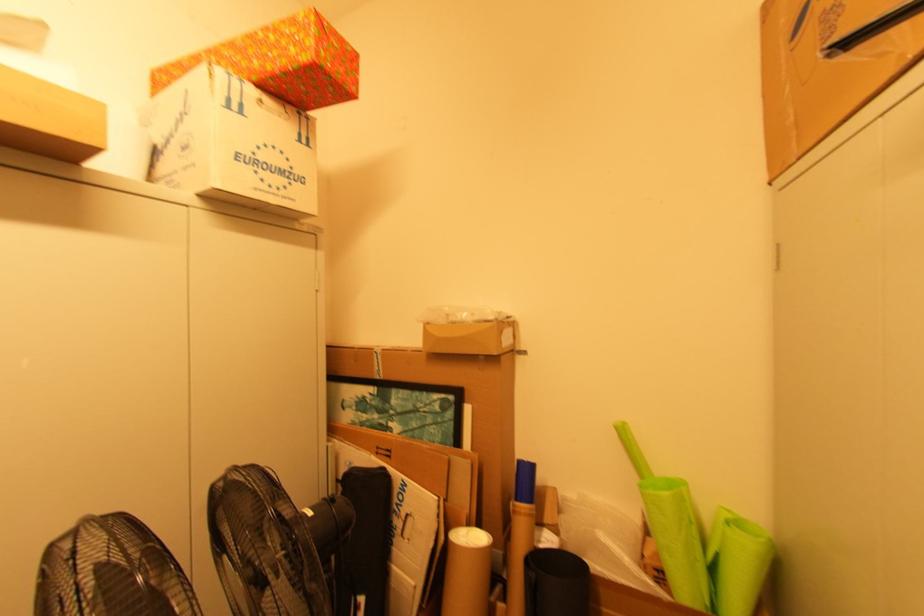
Where would you pull the blue plastic cap? Please return your answer as a coordinate pair (x, y).

(525, 482)